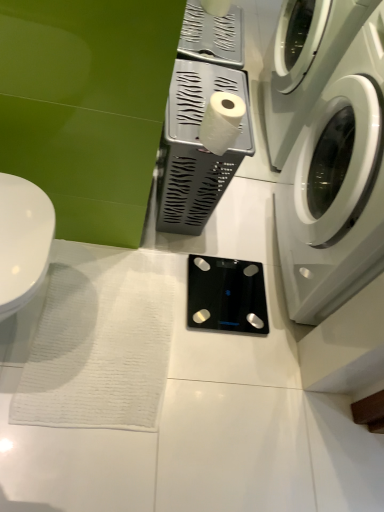
Where is `vacant space in front of white plastic tissue holder at center, which appears as the 2th appliance when ordered from the bottom`? This screenshot has width=384, height=512. vacant space in front of white plastic tissue holder at center, which appears as the 2th appliance when ordered from the bottom is located at coordinates (160, 270).